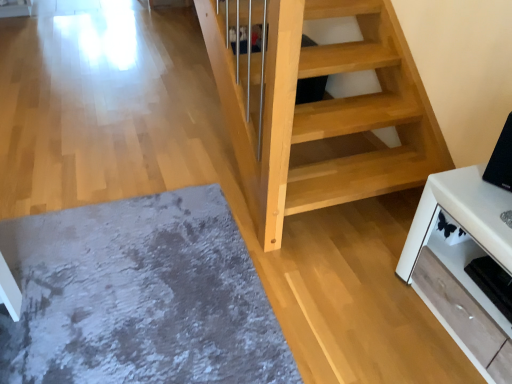
Find the location of a particular element. vacant space to the left of black glossy tv at upper right is located at coordinates (468, 185).